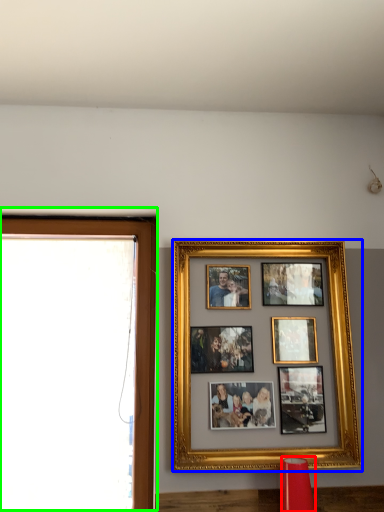
Question: Which is nearer to the lamp (highlighted by a red box)? picture frame (highlighted by a blue box) or window frame (highlighted by a green box).

Choices:
 (A) picture frame
 (B) window frame

Answer: (A)